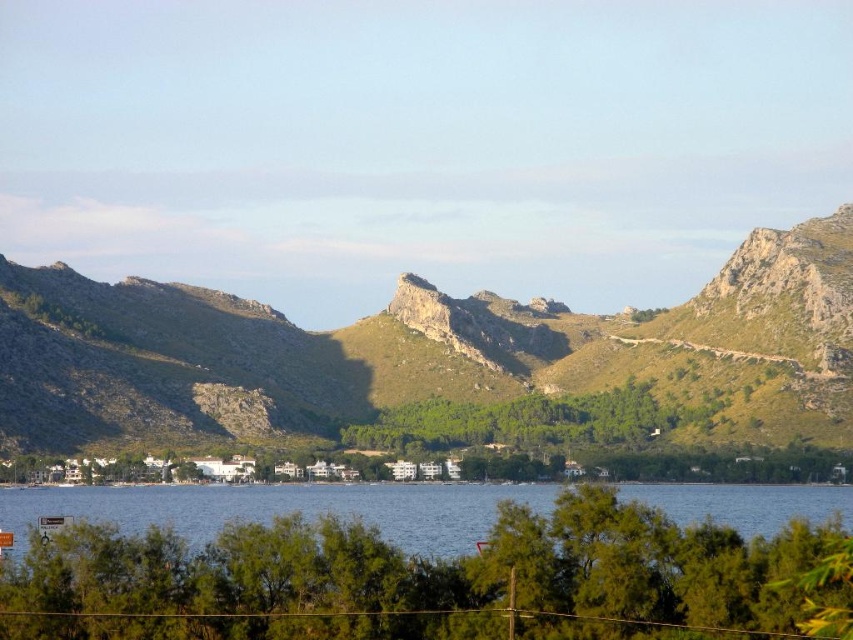
Question: Does green grassy mountain at center come behind blue water at center?

Choices:
 (A) yes
 (B) no

Answer: (A)

Question: Where is green grassy mountain at center located in relation to blue water at center in the image?

Choices:
 (A) above
 (B) below

Answer: (A)

Question: Which point is closer to the camera?

Choices:
 (A) blue water at center
 (B) green grassy mountain at center

Answer: (A)

Question: Which point appears farthest from the camera in this image?

Choices:
 (A) (802, 300)
 (B) (820, 509)

Answer: (A)

Question: Observing the image, what is the correct spatial positioning of green grassy mountain at center in reference to blue water at center?

Choices:
 (A) above
 (B) below

Answer: (A)